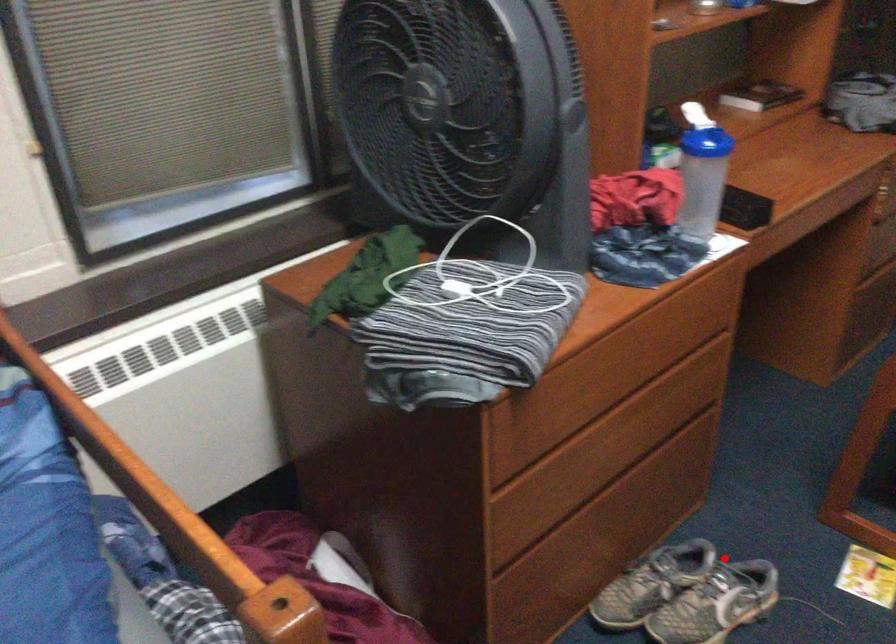
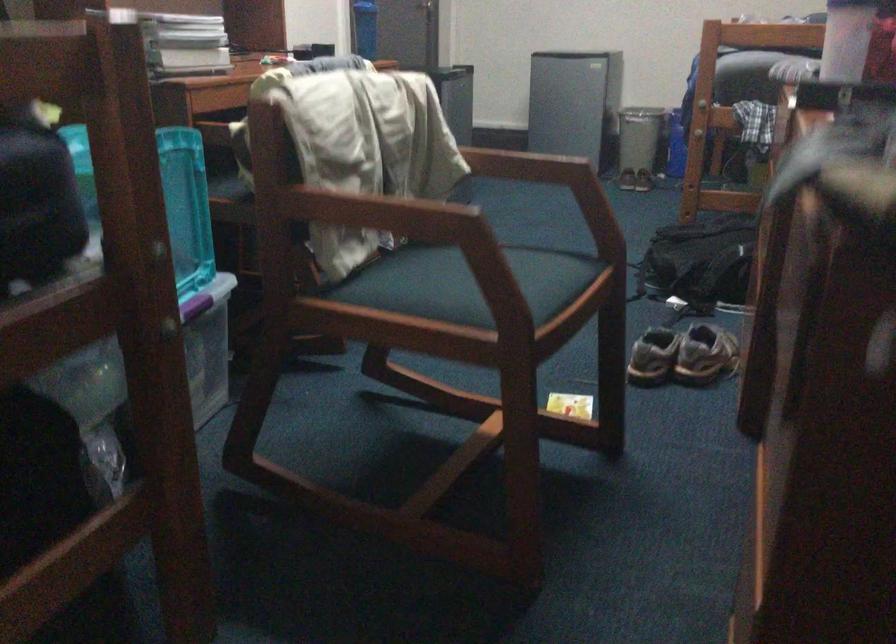
Question: I am providing you with two images of the same scene from different viewpoints. In image1, a red point is highlighted. Considering the same 3D point in image2, which of the following is correct?

Choices:
 (A) It is closer
 (B) It is farther

Answer: (B)